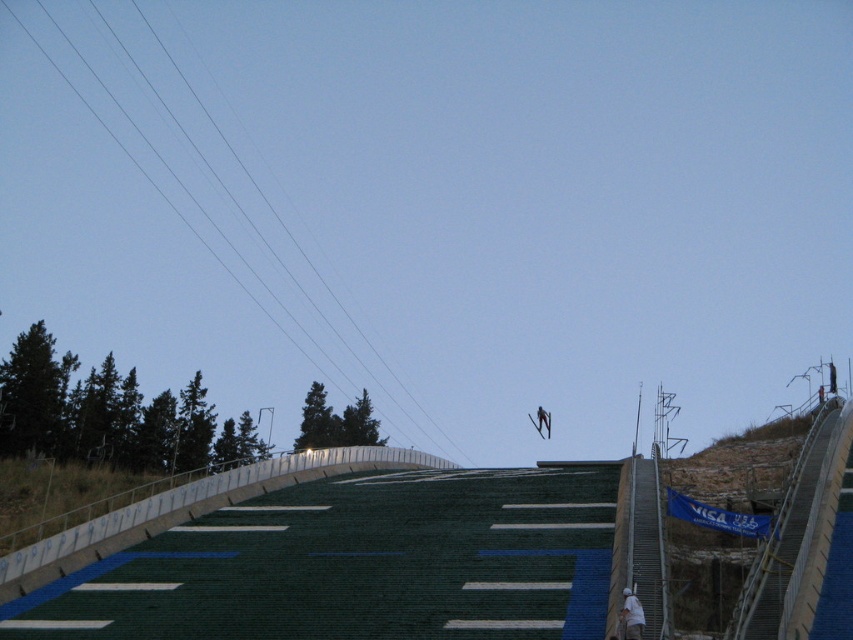
How distant is white fabric at lower right from metallic silver ski at center?

94.44 meters

Does white fabric at lower right come behind metallic silver ski at center?

No, white fabric at lower right is closer to the viewer.

Does point (634, 616) come farther from viewer compared to point (547, 417)?

That is False.

Locate an element on the screen. Image resolution: width=853 pixels, height=640 pixels. white fabric at lower right is located at coordinates pos(631,616).